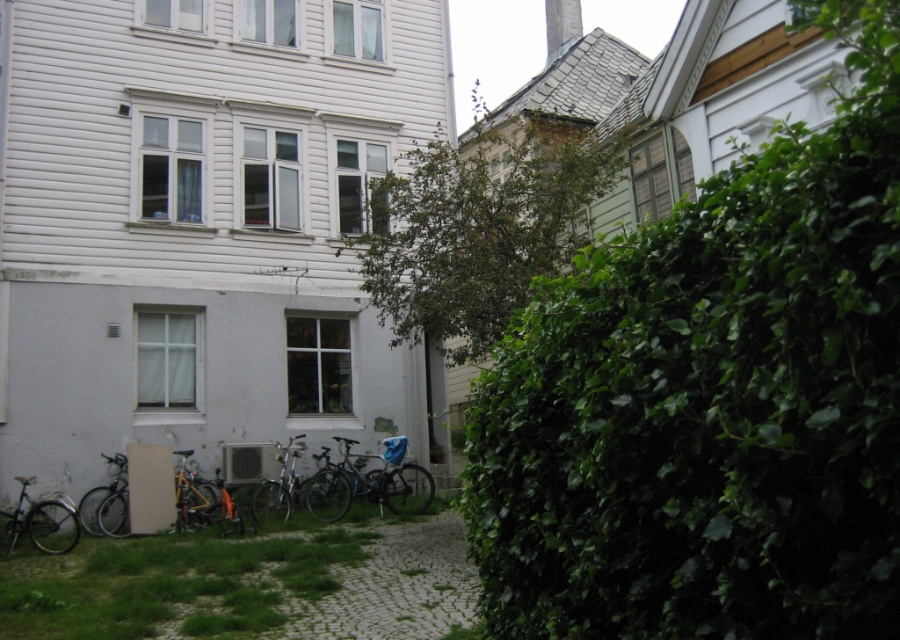
Who is higher up, shiny blue bicycle at center or silver metallic bicycle at lower left?

shiny blue bicycle at center

Where is `shiny blue bicycle at center`? shiny blue bicycle at center is located at coordinates (367, 481).

Does point (96, 529) lie in front of point (258, 524)?

That is False.

Can you confirm if orange matte bicycle at lower left is bigger than silver metallic bicycle at center?

Incorrect, orange matte bicycle at lower left is not larger than silver metallic bicycle at center.

Who is more forward, (190, 484) or (261, 481)?

Point (190, 484)

Where is `orange matte bicycle at lower left`? This screenshot has height=640, width=900. orange matte bicycle at lower left is located at coordinates (346, 488).

Can you confirm if shiny silver bicycle at lower left is positioned below white smooth chimney at upper center?

Correct, shiny silver bicycle at lower left is located below white smooth chimney at upper center.

Which is below, shiny silver bicycle at lower left or white smooth chimney at upper center?

shiny silver bicycle at lower left is below.

The width and height of the screenshot is (900, 640). Identify the location of shiny silver bicycle at lower left. (42, 520).